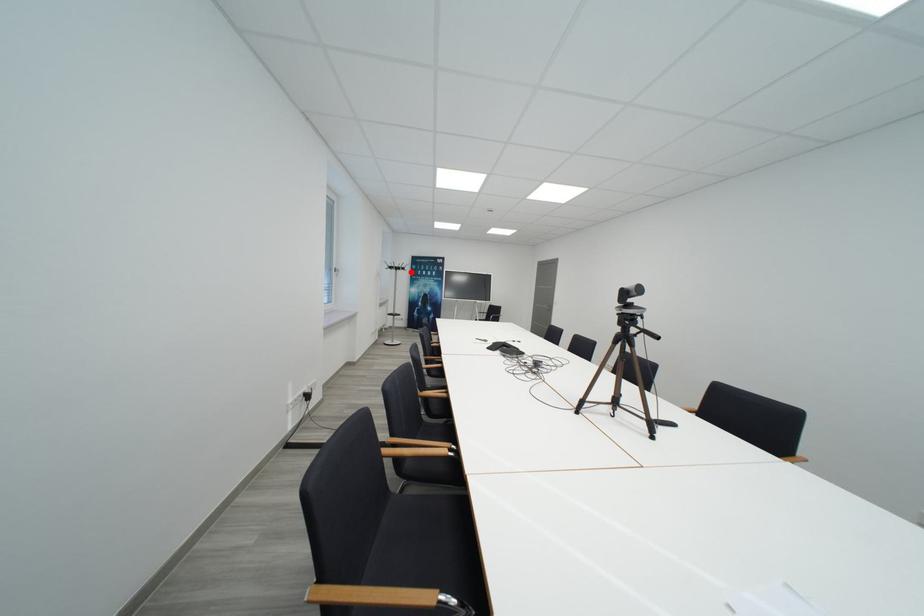
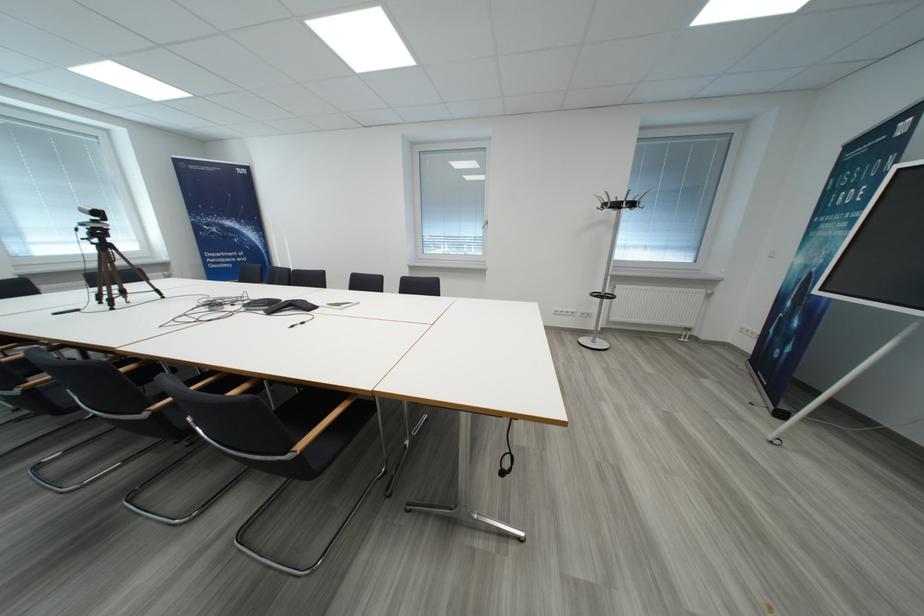
Question: I am providing you with two images of the same scene from different viewpoints. A red point is marked on the first image. Can you still see the location of the red point in image 2?

Choices:
 (A) Yes
 (B) No

Answer: (A)